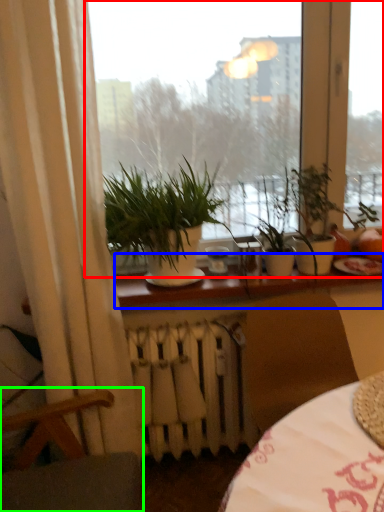
Question: Which is nearer to the window (highlighted by a red box)? window sill (highlighted by a blue box) or armchair (highlighted by a green box).

Choices:
 (A) window sill
 (B) armchair

Answer: (A)